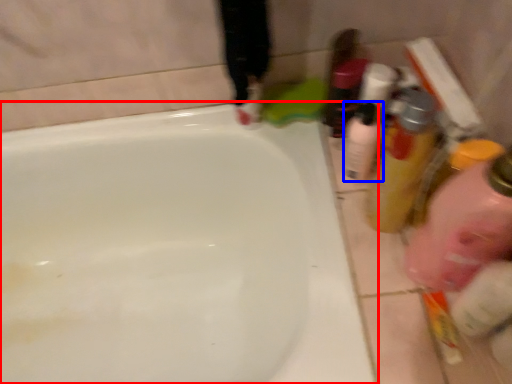
Question: Which point is further to the camera, bathtub (highlighted by a red box) or mouthwash (highlighted by a blue box)?

Choices:
 (A) bathtub
 (B) mouthwash

Answer: (B)